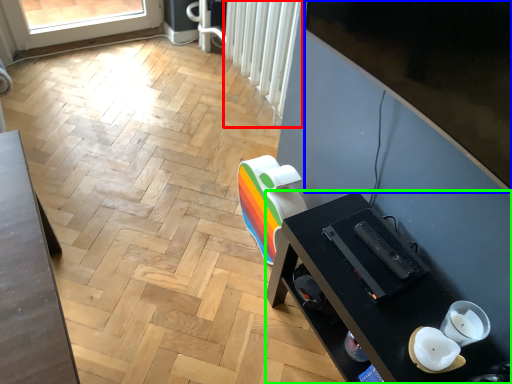
Question: Which object is the farthest from radiator (highlighted by a red box)? Choose among these: window screen (highlighted by a blue box) or desk (highlighted by a green box).

Choices:
 (A) window screen
 (B) desk

Answer: (B)